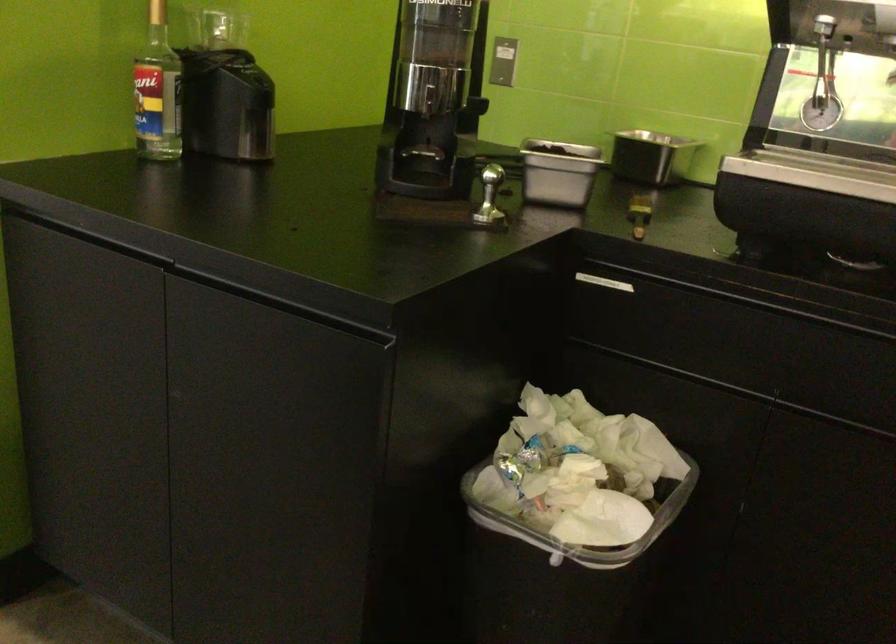
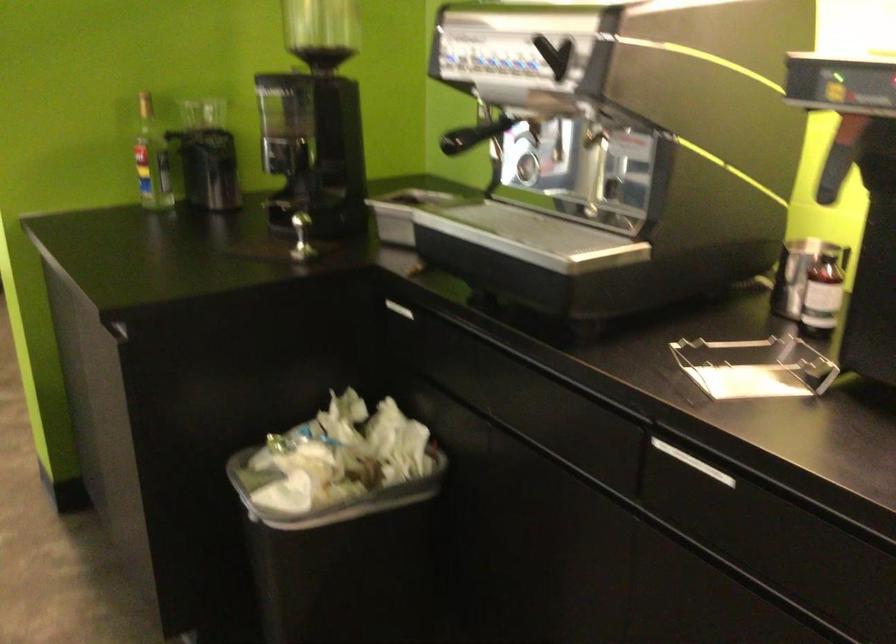
Find the pixel in the second image that matches point 168,90 in the first image.

(151, 158)